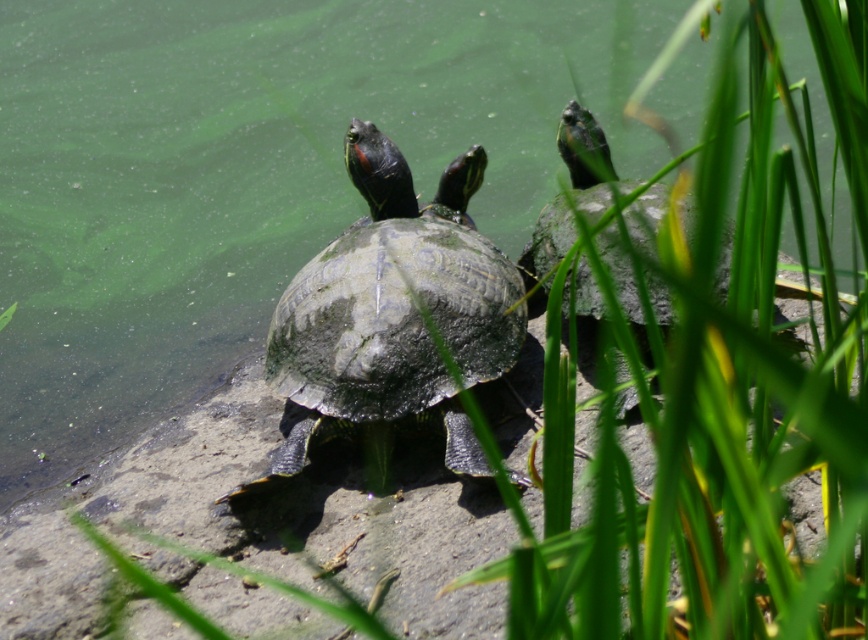
Between green scaly tortoise at center and green scaly tortoise at upper right, which one has more height?

green scaly tortoise at center is taller.

Which is in front, point (339, 236) or point (562, 220)?

Point (562, 220)

Where is `green scaly tortoise at center`? green scaly tortoise at center is located at coordinates (393, 312).